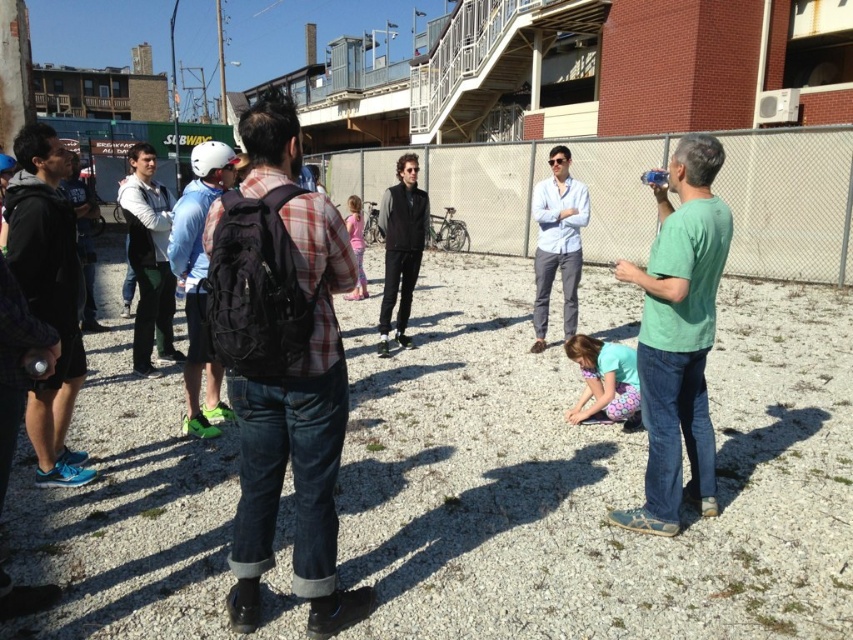
Question: Can you confirm if black matte vest at center is bigger than light blue fabric at lower center?

Choices:
 (A) yes
 (B) no

Answer: (A)

Question: Which object is the closest to the light blue shirt at center?

Choices:
 (A) gray chain-link fence at center
 (B) denim jeans at center

Answer: (B)

Question: Is matte black backpack at center-left above light blue shirt at center?

Choices:
 (A) no
 (B) yes

Answer: (A)

Question: Is denim jeans at center positioned before gray chain-link fence at center?

Choices:
 (A) yes
 (B) no

Answer: (A)

Question: Considering the real-world distances, which object is closest to the light blue fabric at lower center?

Choices:
 (A) light gray backpack at center
 (B) gray gravel at center
 (C) matte black backpack at center-left
 (D) black matte vest at center

Answer: (B)

Question: Which of the following is the closest to the observer?

Choices:
 (A) (86, 256)
 (B) (276, 387)
 (C) (196, 216)

Answer: (B)